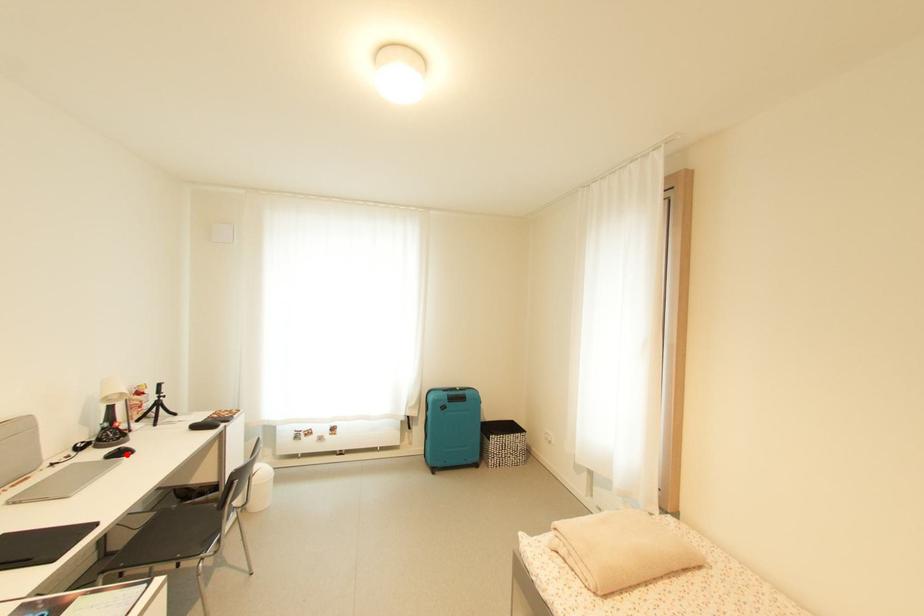
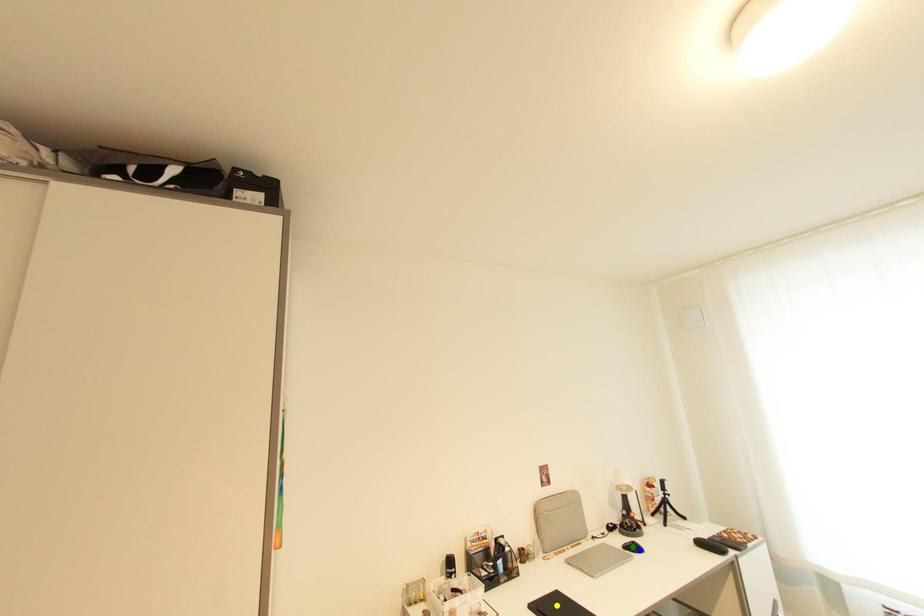
Question: I am providing you with two images of the same scene from different viewpoints. A red point is marked on the first image. You are given multiple points on the second image. In image 2, which mark is for the same physical point as the one in image 1?

Choices:
 (A) blue point
 (B) yellow point
 (C) green point

Answer: (A)